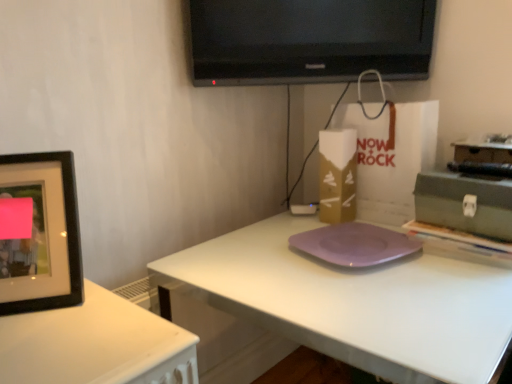
You are a GUI agent. You are given a task and a screenshot of the screen. Output one action in this format:
    pyautogui.click(x=<x>, y=<y>)
    Task: Click on the free spot above purple matte pad at center (from a real-world perspective)
    The height and width of the screenshot is (384, 512).
    Given the screenshot: What is the action you would take?
    pyautogui.click(x=361, y=241)